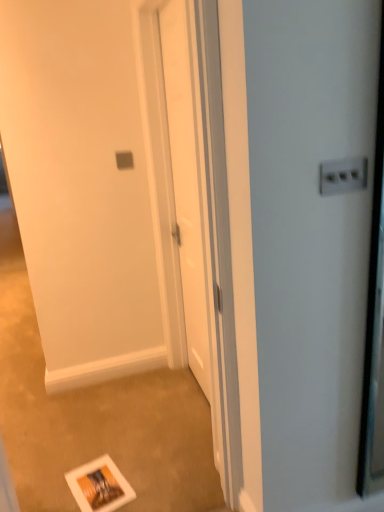
Where is `empty space that is ontop of white matte postcard at lower center`? The height and width of the screenshot is (512, 384). empty space that is ontop of white matte postcard at lower center is located at coordinates (93, 478).